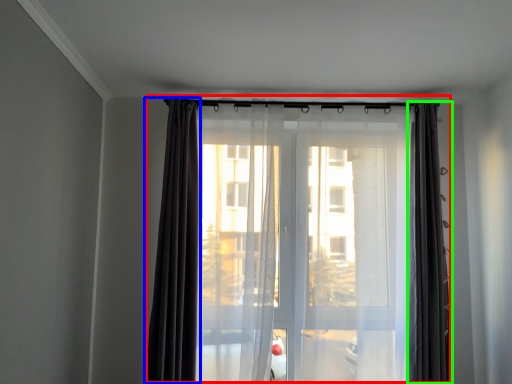
Question: Which object is the closest to the curtain (highlighted by a red box)? Choose among these: curtain (highlighted by a blue box) or curtain (highlighted by a green box).

Choices:
 (A) curtain
 (B) curtain

Answer: (A)